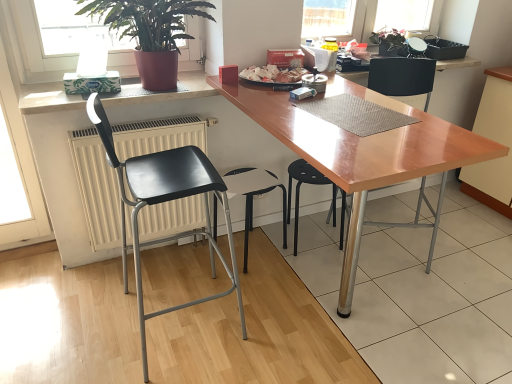
Find the location of a particular element. The width and height of the screenshot is (512, 384). vacant area that lies between black plastic stool at center, positioned as the third chair in right-to-left order, and black plastic stool at center, placed as the second chair when sorted from right to left is located at coordinates (278, 258).